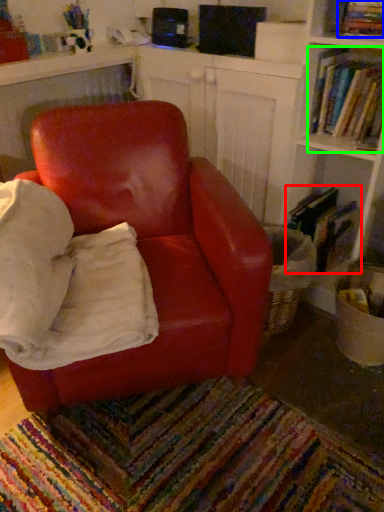
Question: Which is farther away from book (highlighted by a red box)? book (highlighted by a blue box) or book (highlighted by a green box)?

Choices:
 (A) book
 (B) book

Answer: (A)